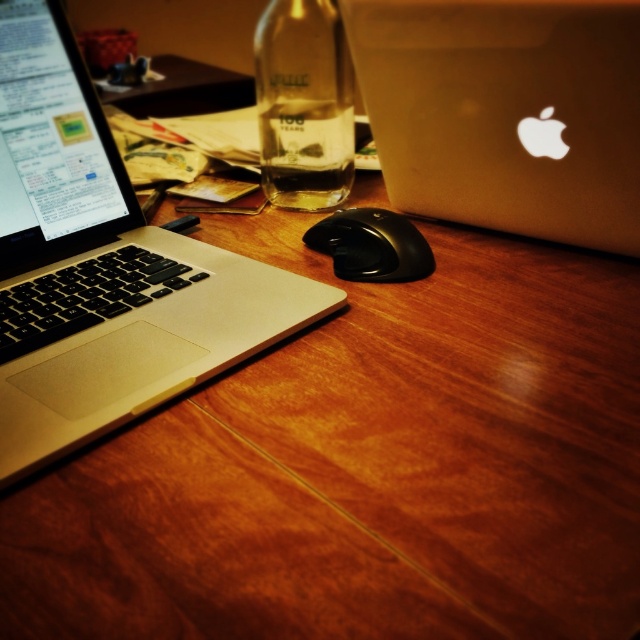
What do you see at coordinates (506, 113) in the screenshot?
I see `silver metallic laptop at upper right` at bounding box center [506, 113].

The width and height of the screenshot is (640, 640). In order to click on silver metallic laptop at upper right in this screenshot , I will do `click(506, 113)`.

Does point (88, 170) lie behind point (353, 108)?

No, it is not.

Does silver metallic laptop at left have a lesser height compared to clear glass bottle at center?

No.

Who is more distant from viewer, (33,333) or (312,109)?

The point (312,109) is more distant.

Find the location of a particular element. Image resolution: width=640 pixels, height=640 pixels. silver metallic laptop at left is located at coordinates (104, 266).

Can you confirm if silver metallic laptop at left is positioned below silver metallic laptop at upper right?

Yes, silver metallic laptop at left is below silver metallic laptop at upper right.

Between silver metallic laptop at left and silver metallic laptop at upper right, which one appears on the right side from the viewer's perspective?

From the viewer's perspective, silver metallic laptop at upper right appears more on the right side.

Which is in front, point (128, 266) or point (467, 131)?

Point (128, 266)

Identify the location of silver metallic laptop at left. (104, 266).